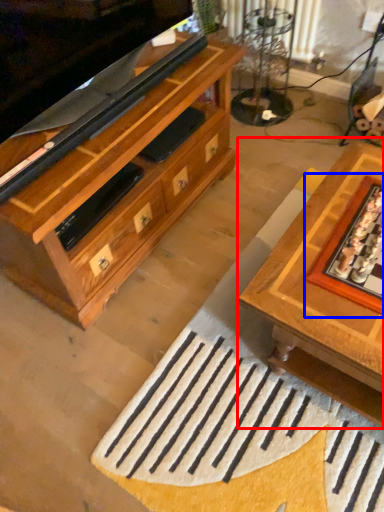
Question: Which point is further to the camera, table (highlighted by a red box) or board game (highlighted by a blue box)?

Choices:
 (A) table
 (B) board game

Answer: (B)